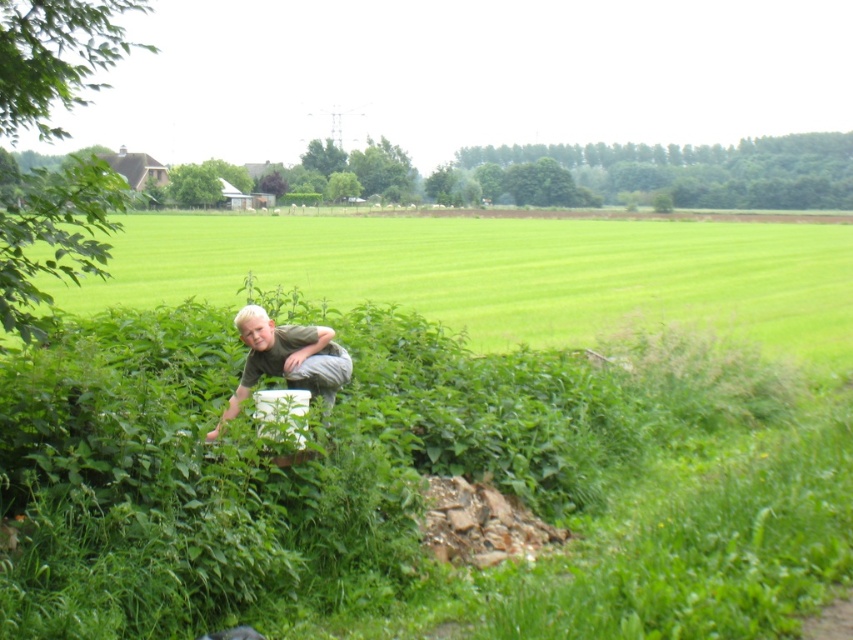
Which is above, green grass at lower center or light brown fabric shirt at center?

green grass at lower center is above.

Does green grass at lower center appear over light brown fabric shirt at center?

Yes, green grass at lower center is above light brown fabric shirt at center.

Measure the distance between point (x=381, y=284) and camera.

Point (x=381, y=284) is 33.57 meters away from camera.

Where is `green grass at lower center`? This screenshot has width=853, height=640. green grass at lower center is located at coordinates (508, 275).

Is point (166, 408) positioned in front of point (131, 240)?

Yes, it is.

Find the location of a particular element. Image resolution: width=853 pixels, height=640 pixels. green leafy grass at center is located at coordinates (440, 433).

What do you see at coordinates (440, 433) in the screenshot? Image resolution: width=853 pixels, height=640 pixels. I see `green leafy grass at center` at bounding box center [440, 433].

Locate an element on the screen. The image size is (853, 640). green leafy grass at center is located at coordinates (440, 433).

Can you confirm if green leafy grass at center is smaller than light brown fabric shirt at center?

No, green leafy grass at center is not smaller than light brown fabric shirt at center.

What do you see at coordinates (440, 433) in the screenshot?
I see `green leafy grass at center` at bounding box center [440, 433].

This screenshot has width=853, height=640. Find the location of `green leafy grass at center`. green leafy grass at center is located at coordinates (440, 433).

The width and height of the screenshot is (853, 640). What are the coordinates of `green leafy grass at center` in the screenshot? It's located at (440, 433).